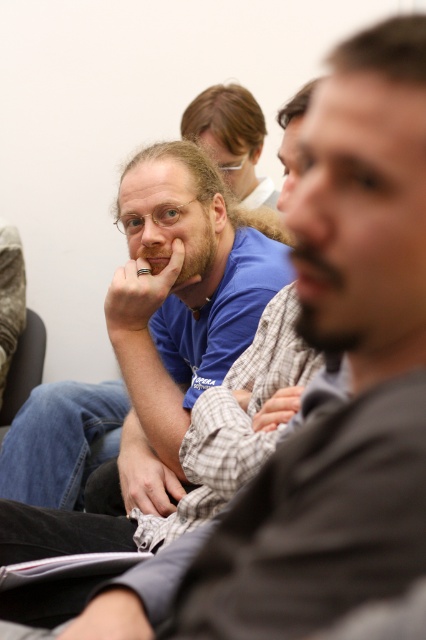
Between matte blue shirt at center and dark gray fabric armchair at lower left, which one has less height?

Standing shorter between the two is dark gray fabric armchair at lower left.

Locate an element on the screen. Image resolution: width=426 pixels, height=640 pixels. matte blue shirt at center is located at coordinates (230, 140).

Can you confirm if matte blue shirt at center is bigger than matte skin at center?

Yes.

Can you confirm if matte blue shirt at center is thinner than matte skin at center?

No, matte blue shirt at center is not thinner than matte skin at center.

Which is in front, point (221, 154) or point (147, 259)?

Positioned in front is point (147, 259).

You are a GUI agent. You are given a task and a screenshot of the screen. Output one action in this format:
    pyautogui.click(x=<x>, y=<y>)
    Task: Click on the matte blue shirt at center
    
    Given the screenshot: What is the action you would take?
    pyautogui.click(x=230, y=140)

Is dark gray fabric armchair at lower left shorter than matte skin at center?

In fact, dark gray fabric armchair at lower left may be taller than matte skin at center.

Is point (32, 332) more distant than point (158, 260)?

Yes.

The height and width of the screenshot is (640, 426). Identify the location of dark gray fabric armchair at lower left. (23, 368).